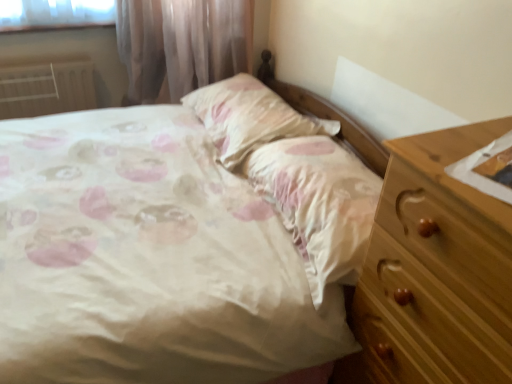
Question: Looking at their shapes, would you say white painted metal radiator at left is wider or thinner than pink satin sheet at center?

Choices:
 (A) thin
 (B) wide

Answer: (A)

Question: From the image's perspective, is white painted metal radiator at left positioned above or below pink satin sheet at center?

Choices:
 (A) above
 (B) below

Answer: (A)

Question: Estimate the real-world distances between objects in this image. Which object is closer to the pink satin sheet at center?

Choices:
 (A) satin floral pillow at center
 (B) white painted metal radiator at left

Answer: (A)

Question: Estimate the real-world distances between objects in this image. Which object is farther from the white painted metal radiator at left?

Choices:
 (A) satin floral pillow at center
 (B) pink satin sheet at center

Answer: (B)